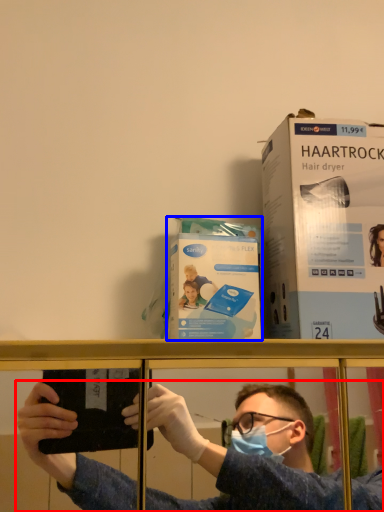
Question: Which object is closer to the camera taking this photo, person (highlighted by a red box) or paperback book (highlighted by a blue box)?

Choices:
 (A) person
 (B) paperback book

Answer: (A)